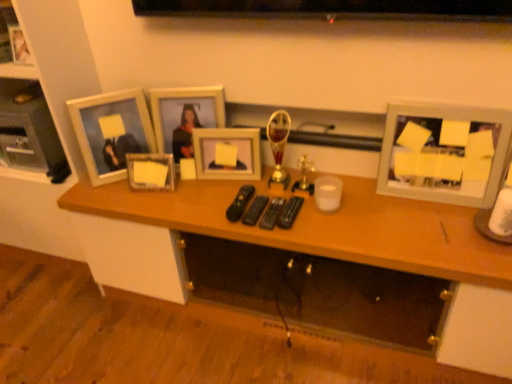
Locate an element on the screen. This screenshot has width=512, height=384. free space in front of matte glass picture frame at center, positioned as the second picture frame in right-to-left order is located at coordinates (215, 197).